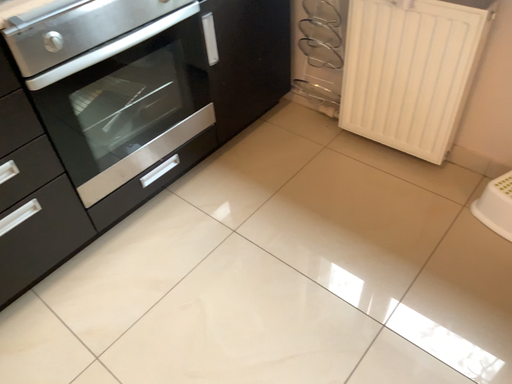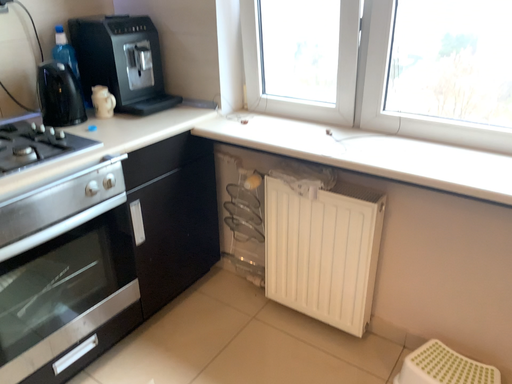
Question: Which way did the camera rotate in the video?

Choices:
 (A) rotated left
 (B) rotated right

Answer: (B)